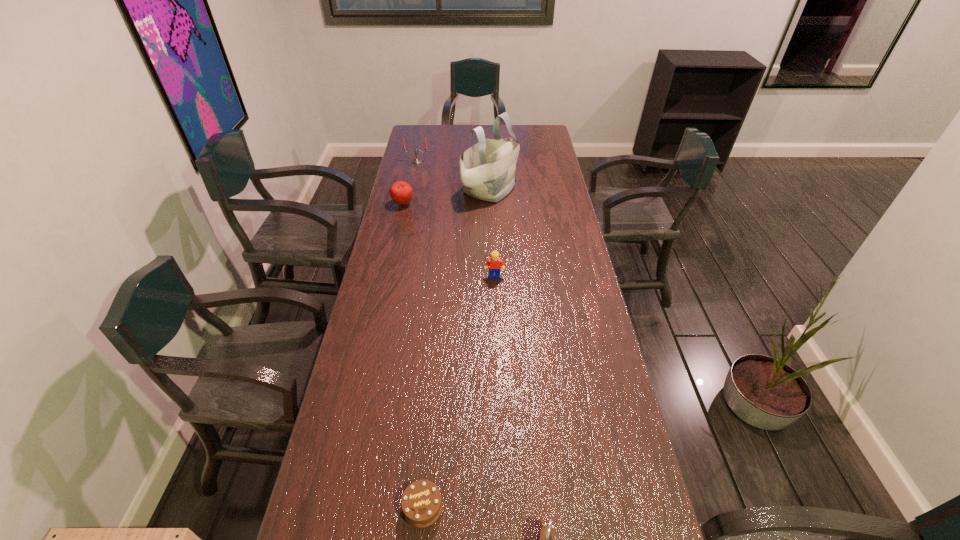
Where is `the tallest object`? The width and height of the screenshot is (960, 540). the tallest object is located at coordinates (487, 169).

Find the location of `the farthest object`. the farthest object is located at coordinates (415, 161).

In order to click on the third nearest object in this screenshot , I will do click(495, 263).

Locate an element on the screen. The height and width of the screenshot is (540, 960). apple is located at coordinates (401, 192).

Find the location of a particular element. The image size is (960, 540). chocolate cake is located at coordinates (421, 502).

The height and width of the screenshot is (540, 960). Find the location of `vacant space located 0.180m on the left of the shopping bag`. vacant space located 0.180m on the left of the shopping bag is located at coordinates (421, 190).

Locate an element on the screen. This screenshot has width=960, height=540. free location located on the front-facing side of the candle is located at coordinates (409, 197).

Where is `vacant region located on the face of the Lego`? The width and height of the screenshot is (960, 540). vacant region located on the face of the Lego is located at coordinates (496, 316).

The height and width of the screenshot is (540, 960). Identify the location of vacant space located on the front of the apple. (394, 242).

Locate an element on the screen. The image size is (960, 540). blank area located on the right of the shortest object is located at coordinates (551, 507).